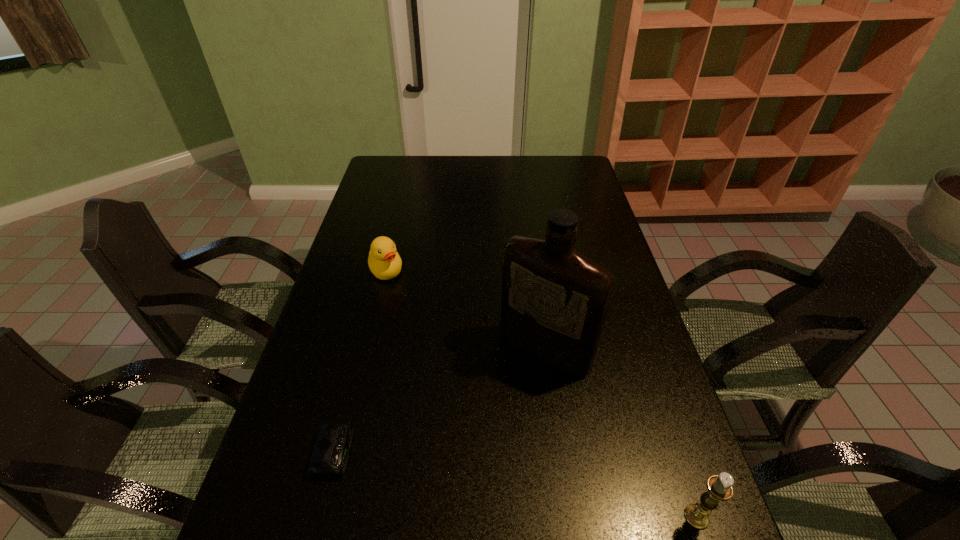
Identify the location of object situated at the near right corner. (719, 487).

This screenshot has width=960, height=540. In the image, there is a desktop. Identify the location of vacant space at the far edge. (415, 165).

Image resolution: width=960 pixels, height=540 pixels. Find the location of `free location at the near edge of the desktop`. free location at the near edge of the desktop is located at coordinates (377, 495).

Locate an element on the screen. vacant area at the left edge is located at coordinates (398, 206).

The image size is (960, 540). Find the location of `vacant region at the right edge of the desktop`. vacant region at the right edge of the desktop is located at coordinates (631, 353).

Identify the location of vacant space at the far left corner. This screenshot has height=540, width=960. (410, 172).

In the image, there is a desktop. Where is `vacant space at the far right corner`? Image resolution: width=960 pixels, height=540 pixels. vacant space at the far right corner is located at coordinates (582, 179).

Find the location of a particular element. unoccupied position between the third tallest object and the third nearest object is located at coordinates (466, 310).

What are the coordinates of `free area in between the second nearest object and the second tallest object` in the screenshot? It's located at (516, 484).

Locate an element on the screen. This screenshot has height=540, width=960. vacant region between the shortest object and the nearest object is located at coordinates (516, 484).